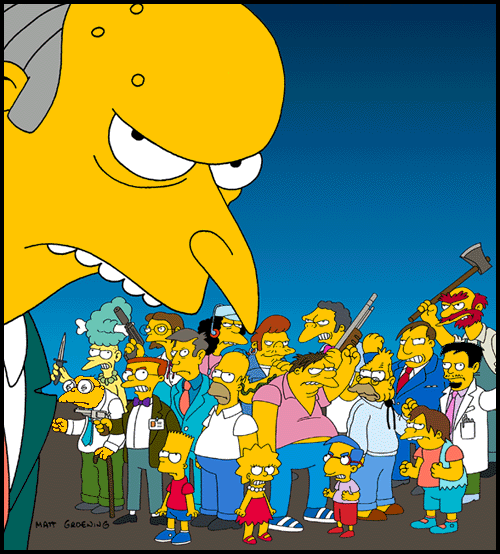
Find the location of a particular element. knife handle is located at coordinates (59, 361).